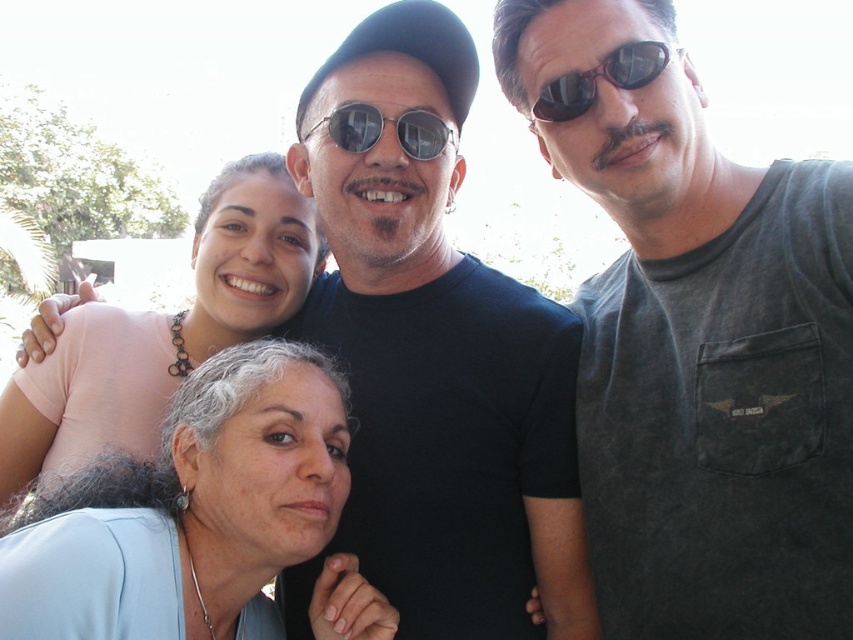
Question: Is light blue fabric at lower left to the right of black reflective sunglasses at upper right from the viewer's perspective?

Choices:
 (A) no
 (B) yes

Answer: (A)

Question: Which point is closer to the camera taking this photo?

Choices:
 (A) 415,128
 (B) 123,481

Answer: (B)

Question: Does gray cotton t-shirt at center have a larger size compared to matte pink shirt at upper left?

Choices:
 (A) yes
 (B) no

Answer: (B)

Question: Can you confirm if black matte t-shirt at upper center is wider than light blue fabric at lower left?

Choices:
 (A) no
 (B) yes

Answer: (A)

Question: Which of the following is the closest to the observer?

Choices:
 (A) metallic reflective sunglasses at center
 (B) gray cotton t-shirt at center

Answer: (B)

Question: Which of the following is the closest to the observer?

Choices:
 (A) matte pink shirt at upper left
 (B) black reflective sunglasses at upper right
 (C) black matte t-shirt at upper center

Answer: (B)